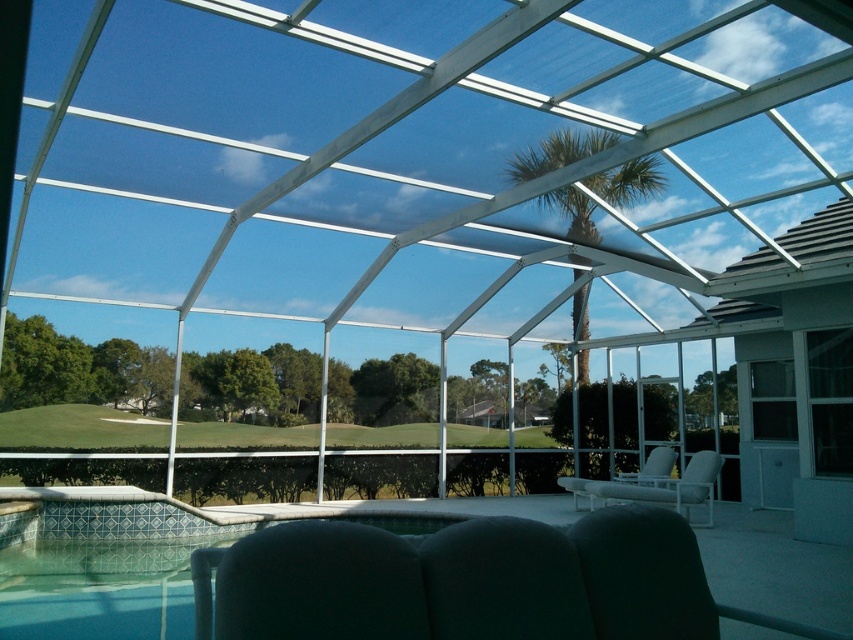
Is point (573, 225) behind point (607, 483)?

Yes, point (573, 225) is behind point (607, 483).

This screenshot has width=853, height=640. I want to click on green leafy palm tree at upper center, so click(x=556, y=152).

Find the location of a particular element. green leafy palm tree at upper center is located at coordinates (556, 152).

Who is higher up, green leafy palm tree at upper center or white plastic chair at lower right?

green leafy palm tree at upper center is higher up.

Based on the photo, can you confirm if green leafy palm tree at upper center is positioned to the right of white plastic chair at lower right?

No, green leafy palm tree at upper center is not to the right of white plastic chair at lower right.

Which is behind, point (607, 170) or point (585, 488)?

Point (585, 488)

Where is `green leafy palm tree at upper center`? This screenshot has height=640, width=853. green leafy palm tree at upper center is located at coordinates (556, 152).

Who is more distant from viewer, [567,618] or [682,496]?

The point [682,496] is more distant.

Does dark fabric chair at lower center have a greater height compared to white plastic chair at lower right?

In fact, dark fabric chair at lower center may be shorter than white plastic chair at lower right.

Is point (463, 577) farther from viewer compared to point (709, 520)?

No, (463, 577) is in front of (709, 520).

Find the location of a particular element. dark fabric chair at lower center is located at coordinates pyautogui.click(x=503, y=580).